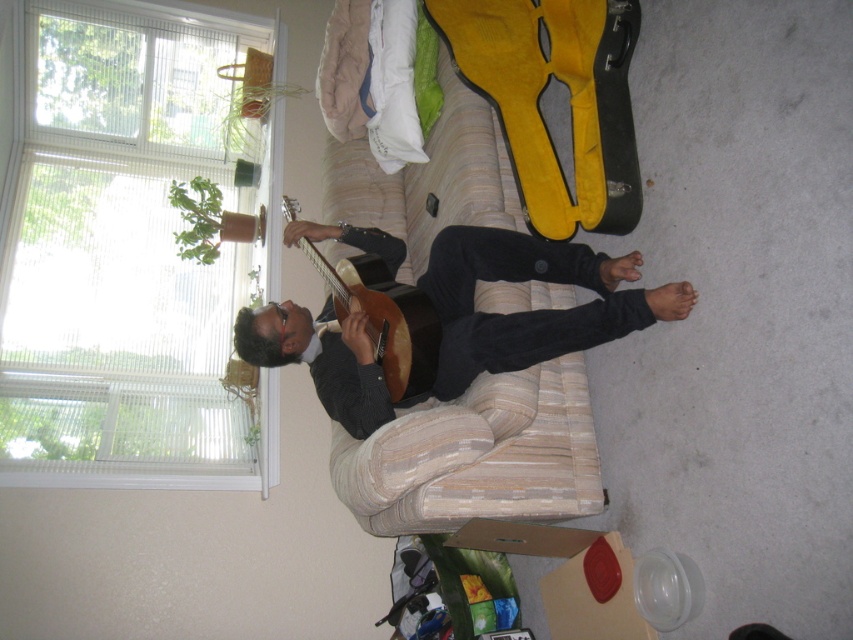
Who is shorter, yellow fabric bed at center or matte brown guitar at center?

Standing shorter between the two is matte brown guitar at center.

Is point (428, 456) closer to camera compared to point (335, 349)?

Yes, it is.

Identify the location of yellow fabric bed at center. Image resolution: width=853 pixels, height=640 pixels. (477, 456).

Can you confirm if yellow fabric bed at center is bigger than wooden acoustic guitar at center?

Yes, yellow fabric bed at center is bigger than wooden acoustic guitar at center.

Based on the photo, can you confirm if yellow fabric bed at center is positioned to the right of wooden acoustic guitar at center?

Indeed, yellow fabric bed at center is positioned on the right side of wooden acoustic guitar at center.

The height and width of the screenshot is (640, 853). In order to click on yellow fabric bed at center in this screenshot , I will do `click(477, 456)`.

Where is `matte brown guitar at center`? matte brown guitar at center is located at coordinates (531, 310).

Is point (502, 349) closer to viewer compared to point (407, 310)?

That is True.

Describe the element at coordinates (531, 310) in the screenshot. I see `matte brown guitar at center` at that location.

I want to click on matte brown guitar at center, so click(531, 310).